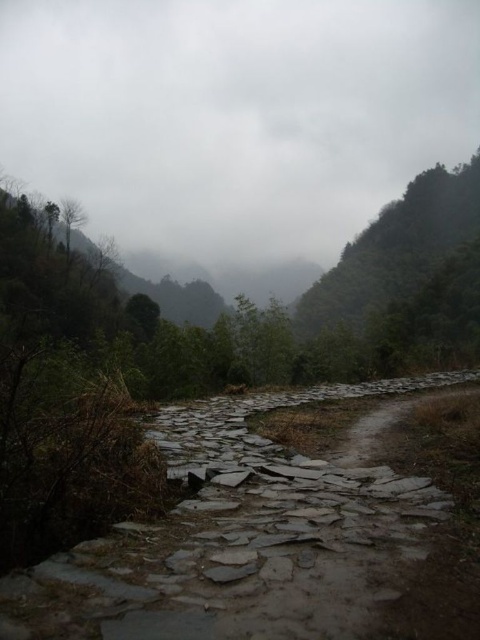
You are a hiker planning to walk along the gray stone path at lower left while looking up at the gray cloudy sky at upper center. Which of these two elements occupies a greater horizontal space in your field of view?

The gray cloudy sky at upper center occupies a greater horizontal space in your field of view because its width is larger than that of the gray stone path at lower left.

You are standing at the starting point of the stone pathway in the valley. You see two points marked on the path ahead of you. One is at coordinates point (86, 211) and the other is at point (45, 593). Which point is closer to you as you walk along the path?

Point (45, 593) is closer to you because it is less further to the camera than point (86, 211).

You are standing at point A and want to reach point B. The coordinates of point A are (321,145). The coordinates of point B are 0.334, 0.451. The distance between them is 186.53 meters. The path is uneven with irregularly shaped stones. Can you walk directly from point A to point B without encountering any obstacles?

The distance between point A and point B is 186.53 meters. The path between them is uneven with irregularly shaped stones, so you can walk directly from point A to point B but may need to navigate the uneven stones.